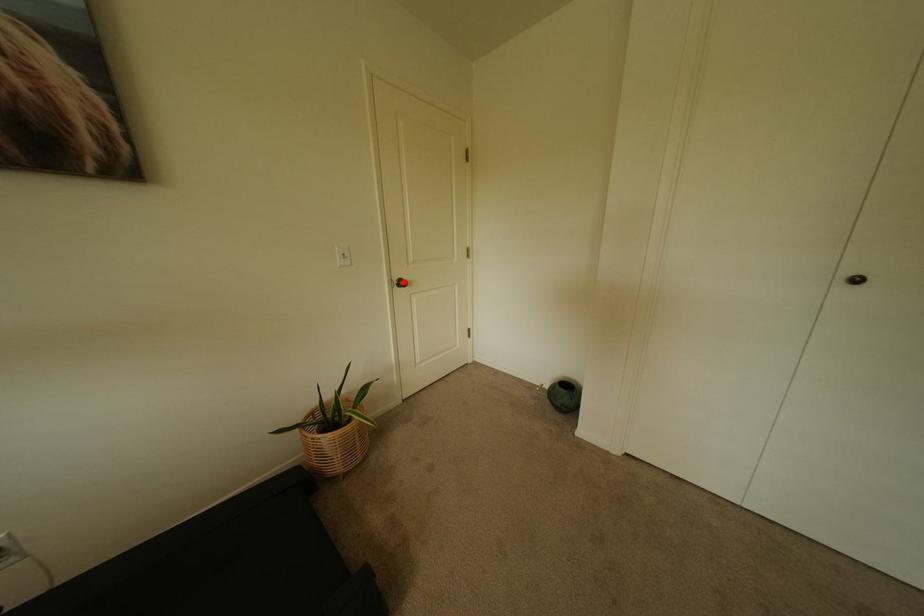
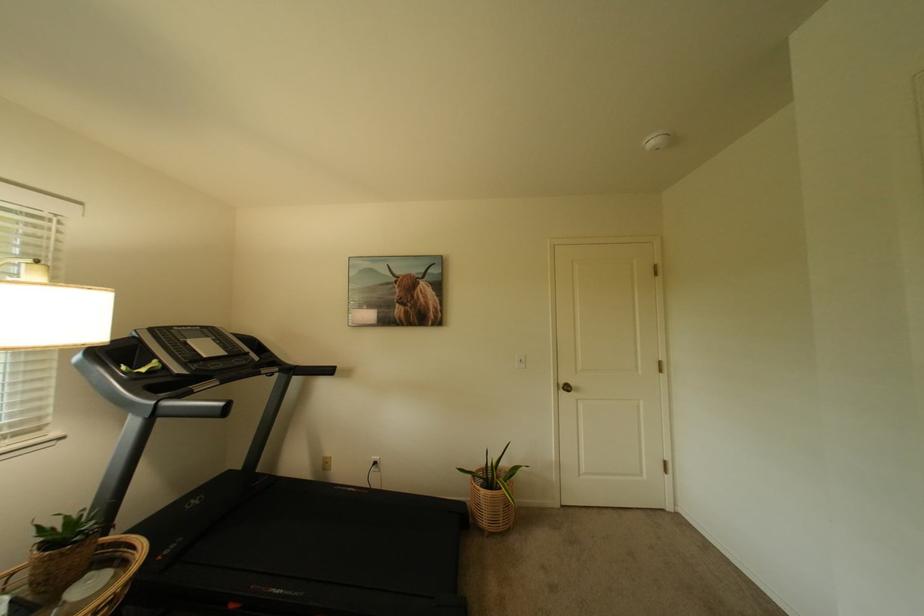
Question: A red point is marked in image1. In image2, is the corresponding 3D point closer to the camera or farther? Reply with the corresponding letter.

Choices:
 (A) The corresponding 3D point is closer.
 (B) The corresponding 3D point is farther.

Answer: (B)